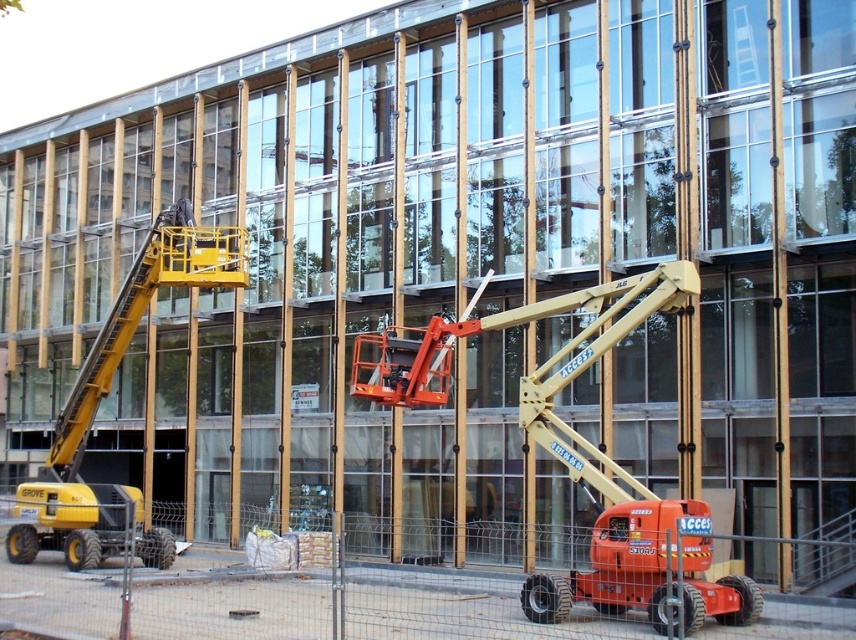
You are a construction worker needing to reach a high window on the building. The orange metallic lift at center and the yellow metallic cherry picker at left are available. Which lift should you choose based on their height capabilities?

The yellow metallic cherry picker at left is taller than the orange metallic lift at center, so you should choose the yellow metallic cherry picker at left to reach the high window.

You are a construction worker needing to move a heavy tool from the yellow rubber construction vehicle at lower left to the yellow metallic cherry picker at left. The tool requires a minimum of 10 feet of space to be safely transported. Can you safely move the tool between these two vehicles?

The yellow rubber construction vehicle at lower left and yellow metallic cherry picker at left are 11.51 feet apart, which exceeds the required 10 feet of space. Therefore, you can safely move the tool between them.

You are a construction worker standing at the center of the construction site. You need to access the second floor of the building. Which vehicle, the yellow rubber construction vehicle at lower left or the yellow metallic cherry picker at left, is better suited for reaching higher elevations?

The yellow metallic cherry picker at left is better suited for reaching higher elevations because it has an extendable arm, unlike the yellow rubber construction vehicle at lower left which is positioned under it and likely cannot reach as high.